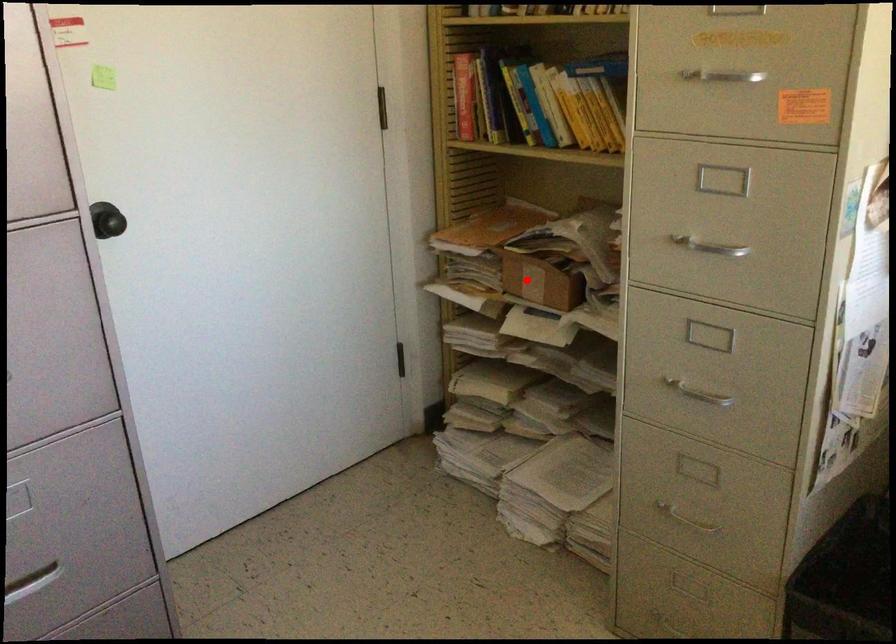
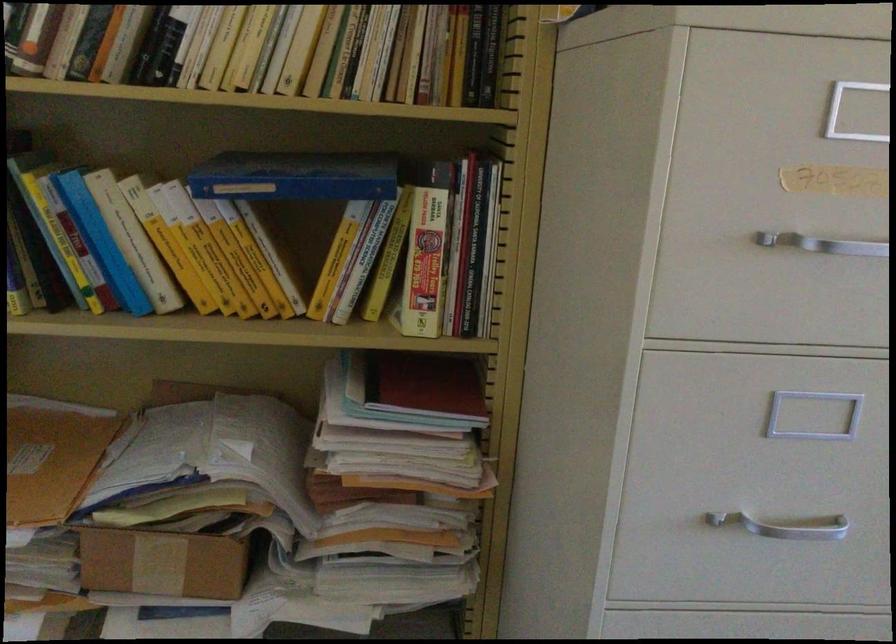
Question: I am providing you with two images of the same scene from different viewpoints. Given a red point in image1, look at the same physical point in image2. Is it:

Choices:
 (A) Closer to the viewpoint
 (B) Farther from the viewpoint

Answer: (A)